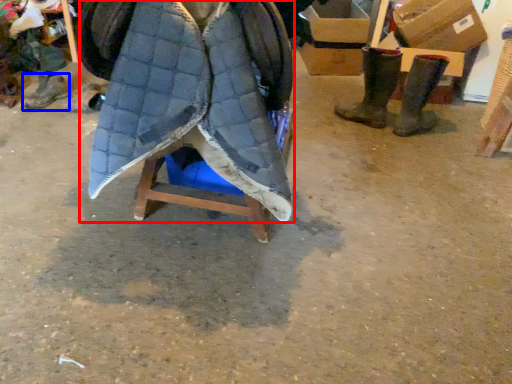
Question: Among these objects, which one is nearest to the camera, cloak (highlighted by a red box) or footwear (highlighted by a blue box)?

Choices:
 (A) cloak
 (B) footwear

Answer: (A)